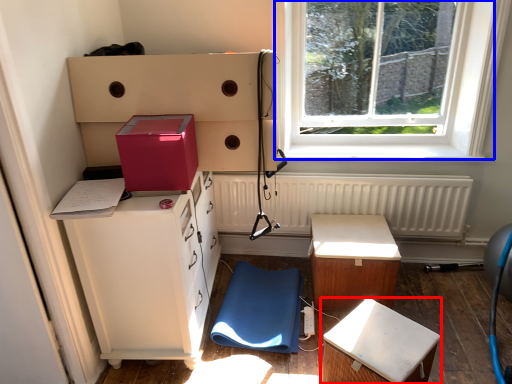
Question: Which point is closer to the camera, furniture (highlighted by a red box) or window (highlighted by a blue box)?

Choices:
 (A) furniture
 (B) window

Answer: (A)